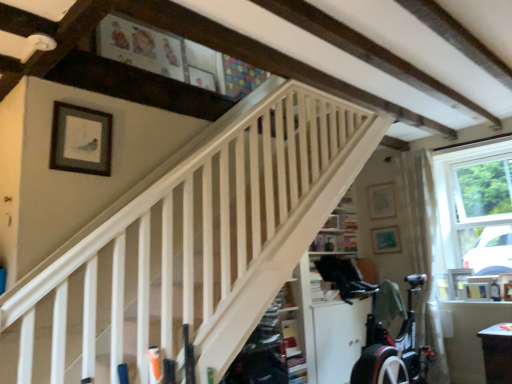
What are the coordinates of `free space in front of matte black picture frame at lower right, placed as the 4th picture frame when sorted from back to front` in the screenshot? It's located at pyautogui.click(x=485, y=302).